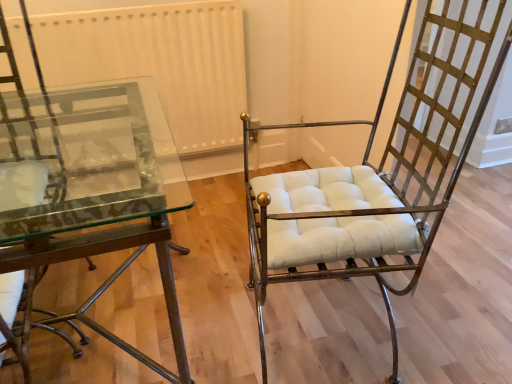
At what (x,y) coordinates should I click in order to perform the action: click on free space above white textured radiator at upper center (from a real-world perspective). Please return your answer as a coordinate pair (x, y). The width and height of the screenshot is (512, 384). Looking at the image, I should click on (115, 11).